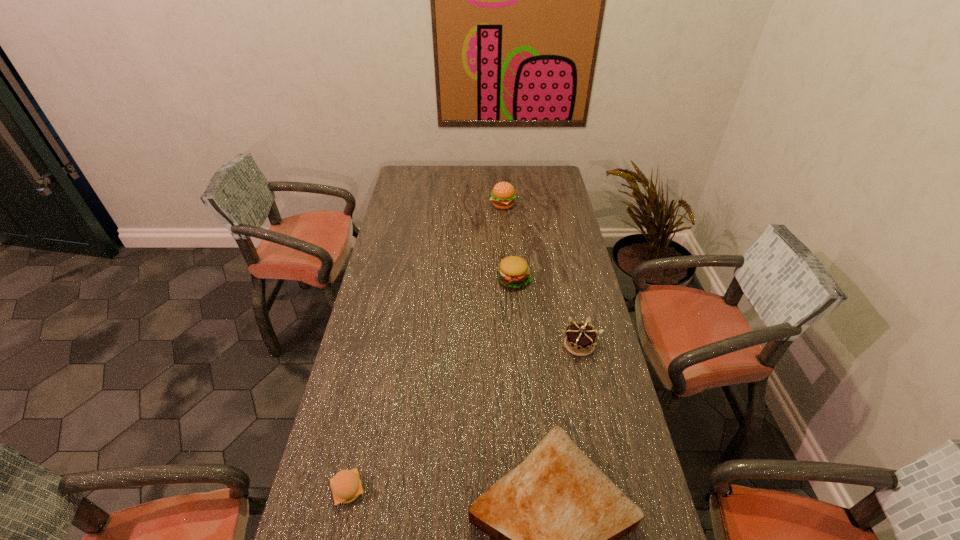
Where is `free space located 0.080m on the back of the leftmost hamburger`? Image resolution: width=960 pixels, height=540 pixels. free space located 0.080m on the back of the leftmost hamburger is located at coordinates (358, 443).

Find the location of `object located in the left edge section of the desktop`. object located in the left edge section of the desktop is located at coordinates (346, 486).

At what (x,y) coordinates should I click in order to perform the action: click on object located in the right edge section of the desktop. Please return your answer as a coordinate pair (x, y). This screenshot has height=540, width=960. Looking at the image, I should click on (580, 339).

This screenshot has width=960, height=540. What are the coordinates of `vacant space at the far edge` in the screenshot? It's located at (446, 183).

Locate an element on the screen. free space at the left edge of the desktop is located at coordinates (400, 312).

Identify the location of free space at the right edge of the desktop. (547, 208).

The height and width of the screenshot is (540, 960). Identify the location of vacant space at the far right corner of the desktop. 558,166.

Where is `vacant space that's between the leftmost object and the farthest hamburger`? vacant space that's between the leftmost object and the farthest hamburger is located at coordinates (425, 348).

Locate an element on the screen. The image size is (960, 540). free area in between the farthest object and the crown is located at coordinates (x=540, y=275).

Find the location of a particular element. The image size is (960, 540). free space between the farthest object and the second shortest hamburger is located at coordinates (509, 242).